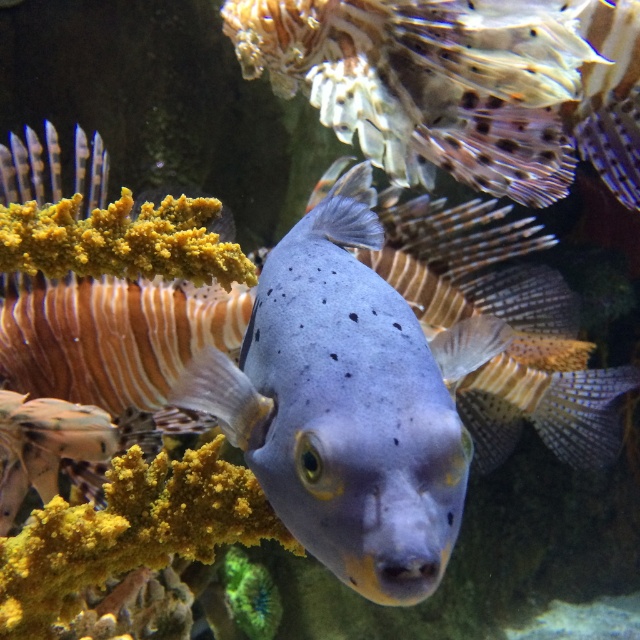
Is point (440, 557) less distant than point (384, 252)?

Yes, it is.

Is point (404, 461) farther from camera compared to point (484, 308)?

No, it is in front of (484, 308).

Which is in front, point (362, 170) or point (458, 304)?

Point (362, 170) is in front.

At what (x,y) coordinates should I click in order to perform the action: click on matte blue fish at center. Please return your answer as a coordinate pair (x, y). Looking at the image, I should click on (348, 403).

Identify the location of smooth blue fish at center. pyautogui.click(x=429, y=83).

Does point (368, 4) lie behind point (476, 436)?

No, (368, 4) is closer to viewer.

Locate an element on the screen. smooth blue fish at center is located at coordinates (429, 83).

Does matte blue fish at center come in front of smooth blue fish at center?

Yes, it is.

Is matte blue fish at center wider than smooth blue fish at center?

No.

Locate an element on the screen. Image resolution: width=640 pixels, height=640 pixels. matte blue fish at center is located at coordinates (348, 403).